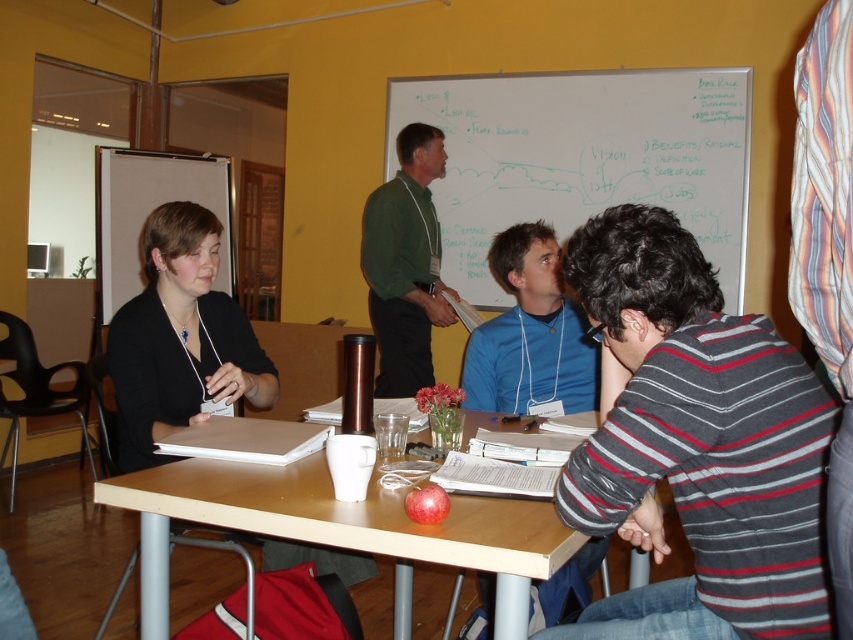
Question: Can you confirm if striped cotton shirt at center is positioned to the left of whiteboard at upper center?

Choices:
 (A) no
 (B) yes

Answer: (B)

Question: Which object appears farthest from the camera in this image?

Choices:
 (A) green matte shirt at center
 (B) black matte jacket at upper left
 (C) red matte apple at center
 (D) striped cotton shirt at center

Answer: (A)

Question: Among these objects, which one is nearest to the camera?

Choices:
 (A) red matte apple at center
 (B) green matte shirt at center
 (C) striped cotton shirt at center
 (D) blue cotton shirt at center

Answer: (C)

Question: Is wooden table at center further to camera compared to blue cotton shirt at center?

Choices:
 (A) no
 (B) yes

Answer: (A)

Question: Does whiteboard at upper center appear on the right side of red matte apple at center?

Choices:
 (A) yes
 (B) no

Answer: (A)

Question: Considering the real-world distances, which object is farthest from the wooden table at center?

Choices:
 (A) striped cotton shirt at center
 (B) green matte shirt at center
 (C) whiteboard at upper center
 (D) blue cotton shirt at center

Answer: (C)